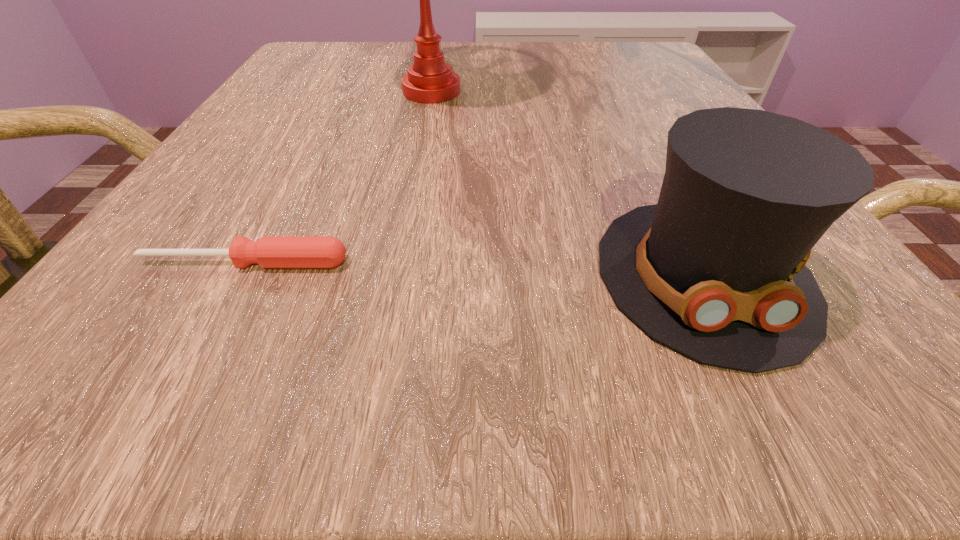
You are a GUI agent. You are given a task and a screenshot of the screen. Output one action in this format:
    pyautogui.click(x=<x>, y=<y>)
    Task: Click on the screwdriver located at the left edge
    
    Given the screenshot: What is the action you would take?
    pyautogui.click(x=269, y=251)

Find the location of a particular element. The width and height of the screenshot is (960, 540). object present at the right edge is located at coordinates (715, 270).

At what (x,y) coordinates should I click in order to perform the action: click on object that is at the far left corner. Please return your answer as a coordinate pair (x, y). The height and width of the screenshot is (540, 960). Looking at the image, I should click on (429, 80).

The height and width of the screenshot is (540, 960). I want to click on object that is at the near right corner, so click(x=715, y=270).

Identify the location of vacant region at the far edge of the desktop. The height and width of the screenshot is (540, 960). (396, 43).

The height and width of the screenshot is (540, 960). What are the coordinates of `vacant space at the left edge` in the screenshot? It's located at (293, 217).

Locate an element on the screen. vacant space at the far left corner of the desktop is located at coordinates point(330,63).

In order to click on blank space at the near left corner of the desktop in this screenshot , I will do `click(35, 397)`.

Locate an element on the screen. Image resolution: width=960 pixels, height=540 pixels. blank space at the far right corner is located at coordinates (596, 48).

Locate an element on the screen. The height and width of the screenshot is (540, 960). vacant region at the near right corner of the desktop is located at coordinates (829, 334).